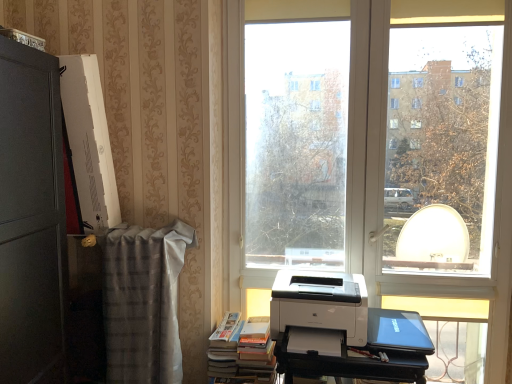
Question: Considering the positions of transparent glass window at center and black plastic printer at lower right in the image, is transparent glass window at center bigger or smaller than black plastic printer at lower right?

Choices:
 (A) big
 (B) small

Answer: (B)

Question: Looking at their shapes, would you say transparent glass window at center is wider or thinner than black plastic printer at lower right?

Choices:
 (A) thin
 (B) wide

Answer: (A)

Question: Which of these objects is positioned closest to the matte black laptop at lower right?

Choices:
 (A) black plastic printer at lower right
 (B) transparent glass window at center
 (C) hardcover books at lower left
 (D) plaid fabric at left
 (E) white glossy printer at center

Answer: (A)

Question: Which object is positioned farthest from the transparent glass window at center?

Choices:
 (A) black plastic printer at lower right
 (B) hardcover books at lower left
 (C) matte black laptop at lower right
 (D) plaid fabric at left
 (E) white glossy printer at center

Answer: (A)